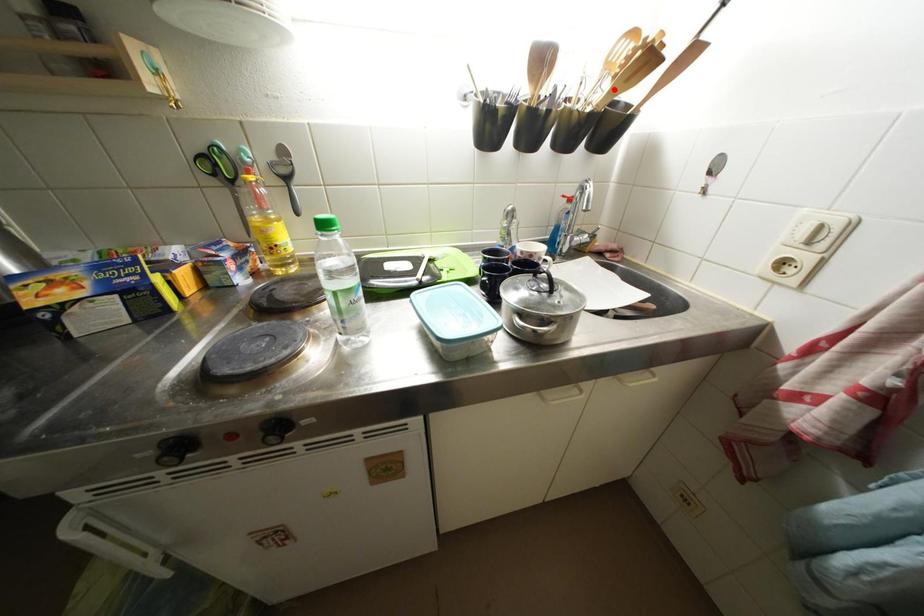
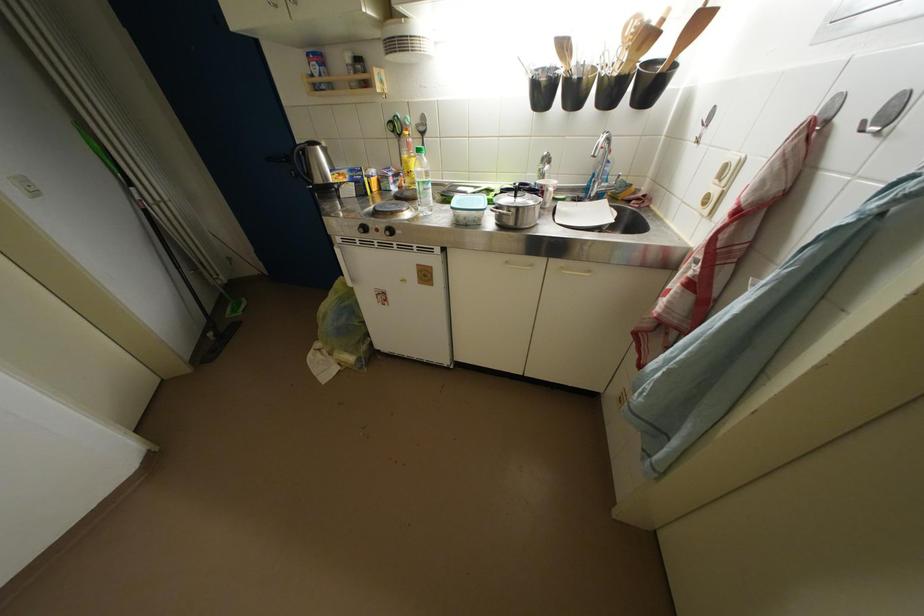
Where in the second image is the point corresponding to the highlighted location from the first image?

(631, 60)